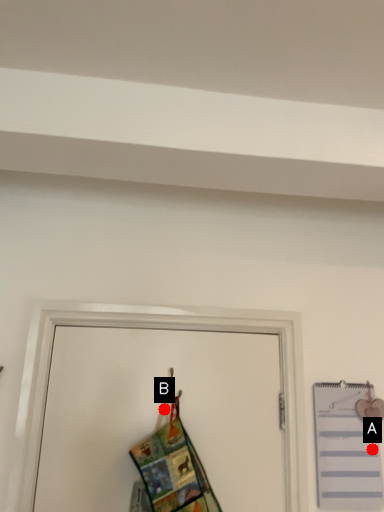
Question: Two points are circled on the image, labeled by A and B beside each circle. Which point is closer to the camera?

Choices:
 (A) A is closer
 (B) B is closer

Answer: (B)